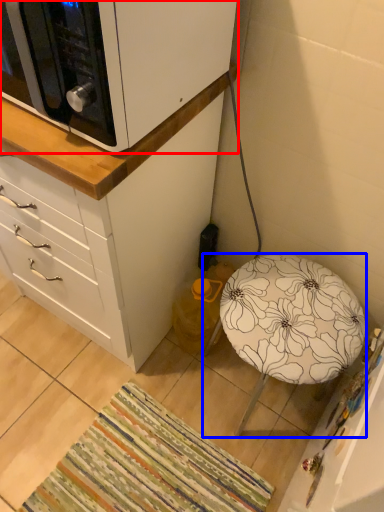
Question: Which point is closer to the camera, cabinetry (highlighted by a red box) or furniture (highlighted by a blue box)?

Choices:
 (A) cabinetry
 (B) furniture

Answer: (A)